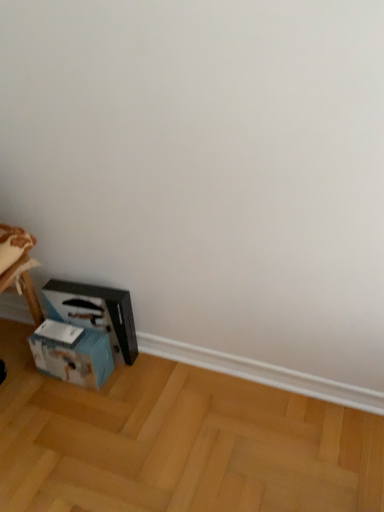
Question: Is blue cardboard box at lower left to the left or to the right of black plastic workbench at lower left in the image?

Choices:
 (A) left
 (B) right

Answer: (A)

Question: Considering the positions of blue cardboard box at lower left and black plastic workbench at lower left in the image, is blue cardboard box at lower left bigger or smaller than black plastic workbench at lower left?

Choices:
 (A) small
 (B) big

Answer: (A)

Question: Considering the real-world distances, which object is farthest from the black plastic workbench at lower left?

Choices:
 (A) light brown wooden floor at lower left
 (B) blue cardboard box at lower left

Answer: (A)

Question: Considering the real-world distances, which object is closest to the light brown wooden floor at lower left?

Choices:
 (A) blue cardboard box at lower left
 (B) black plastic workbench at lower left

Answer: (B)